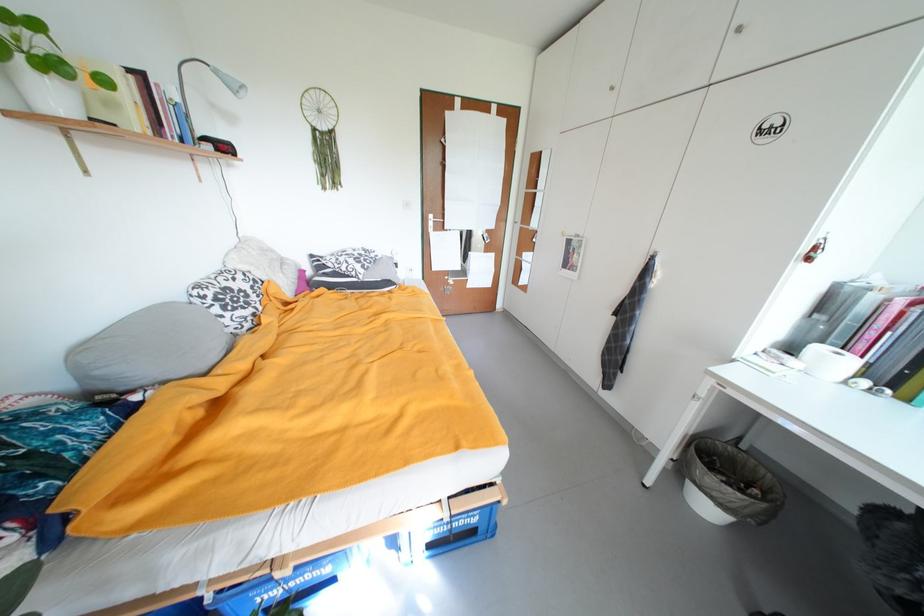
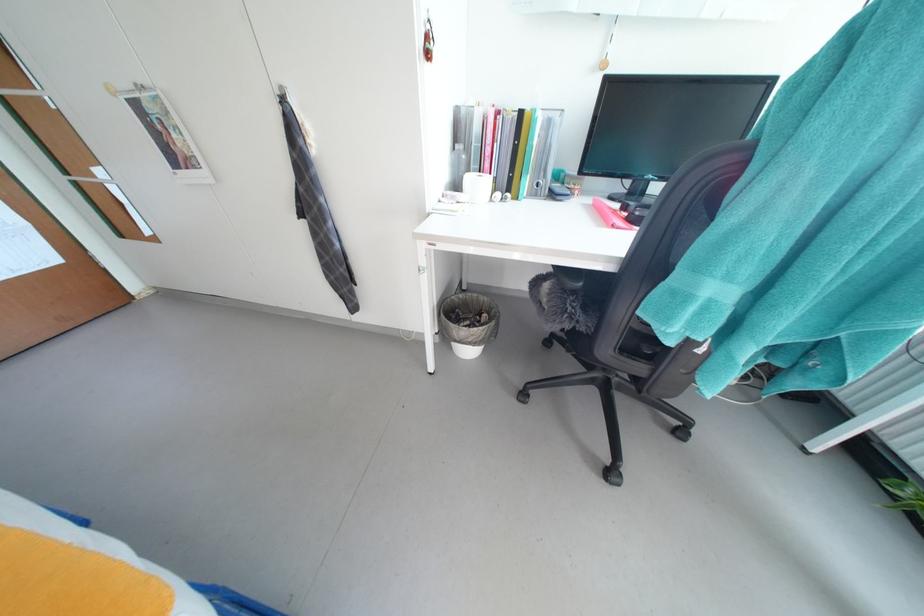
The point at (723, 496) is marked in the first image. Where is the corresponding point in the second image?

(478, 342)